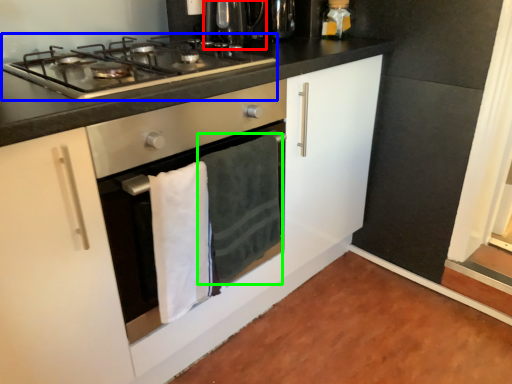
Question: Estimate the real-world distances between objects in this image. Which object is farther from coffee machine (highlighted by a red box), gas stove (highlighted by a blue box) or bath towel (highlighted by a green box)?

Choices:
 (A) gas stove
 (B) bath towel

Answer: (B)